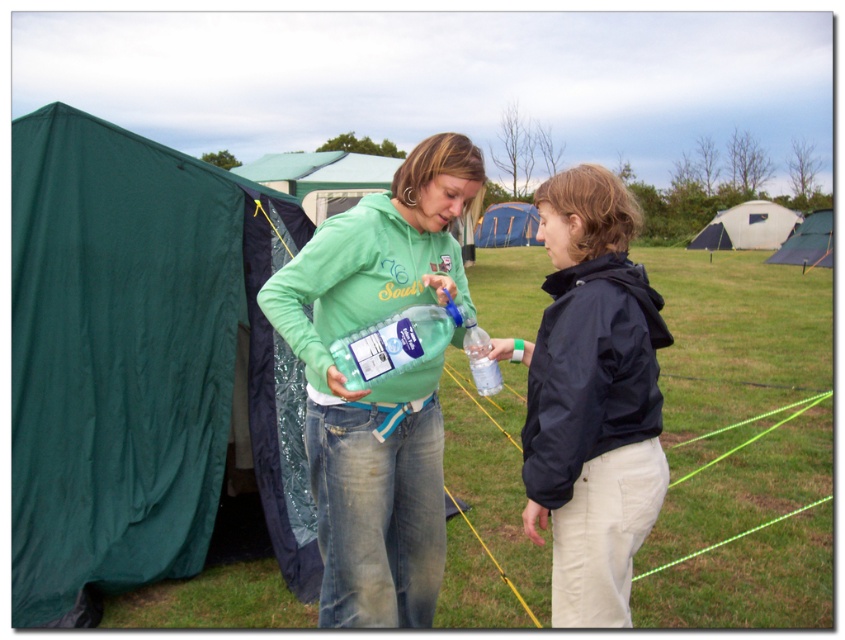
Question: Which object appears farthest from the camera in this image?

Choices:
 (A) white fabric tent at upper right
 (B) green matte hoodie at center
 (C) green fabric tent at left

Answer: (A)

Question: In this image, where is dark blue jacket at center located relative to translucent plastic bottle at center?

Choices:
 (A) right
 (B) left

Answer: (A)

Question: Which of the following is the closest to the observer?

Choices:
 (A) white fabric tent at upper right
 (B) translucent plastic bottle at center

Answer: (B)

Question: Does green canvas tent at upper right have a lesser width compared to clear plastic bottle at center?

Choices:
 (A) yes
 (B) no

Answer: (B)

Question: Based on their relative distances, which object is farther from the white fabric tent at upper right?

Choices:
 (A) clear plastic bottle at center
 (B) green fleece sweatshirt at center
 (C) green matte hoodie at center

Answer: (B)

Question: Can you confirm if green fleece sweatshirt at center is positioned to the left of translucent plastic bottle at center?

Choices:
 (A) yes
 (B) no

Answer: (A)